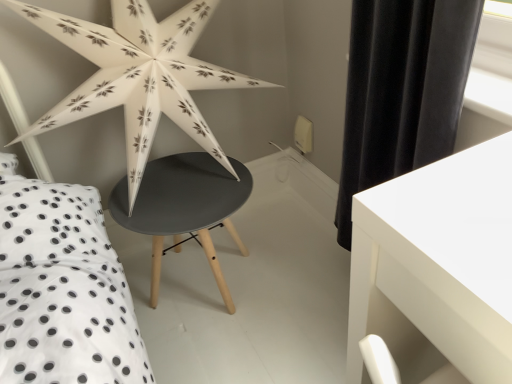
Question: Does white paper star at upper left have a lesser width compared to white glossy table at lower right, the second table positioned from the left?

Choices:
 (A) yes
 (B) no

Answer: (A)

Question: Is white glossy table at lower right, the 2th table positioned from the back, completely or partially inside white paper star at upper left?

Choices:
 (A) no
 (B) yes

Answer: (A)

Question: Is white paper star at upper left closer to the viewer compared to white glossy table at lower right, the second table positioned from the left?

Choices:
 (A) yes
 (B) no

Answer: (B)

Question: Is white paper star at upper left at the right side of white glossy table at lower right, the 1th table positioned from the right?

Choices:
 (A) yes
 (B) no

Answer: (B)

Question: Is white paper star at upper left further to camera compared to white glossy table at lower right, the 1th table positioned from the right?

Choices:
 (A) no
 (B) yes

Answer: (B)

Question: In terms of width, does matte black table at center, arranged as the second table when viewed from the right, look wider or thinner when compared to white glossy table at lower right, the second table positioned from the left?

Choices:
 (A) thin
 (B) wide

Answer: (A)

Question: From a real-world perspective, relative to white glossy table at lower right, the 1th table positioned from the right, is matte black table at center, the first table when ordered from left to right, vertically above or below?

Choices:
 (A) below
 (B) above

Answer: (A)

Question: Is matte black table at center, arranged as the second table when viewed from the right, taller or shorter than white glossy table at lower right, the second table positioned from the left?

Choices:
 (A) short
 (B) tall

Answer: (A)

Question: In the image, is matte black table at center, which is the first table from back to front, positioned in front of or behind white glossy table at lower right, the 1th table positioned from the right?

Choices:
 (A) behind
 (B) front

Answer: (A)

Question: In the image, is white glossy table at lower right, the first table in the front-to-back sequence, on the left side or the right side of matte black table at center, which is the first table from back to front?

Choices:
 (A) left
 (B) right

Answer: (B)

Question: Looking at their shapes, would you say white glossy table at lower right, the first table in the front-to-back sequence, is wider or thinner than matte black table at center, arranged as the second table when viewed from the right?

Choices:
 (A) wide
 (B) thin

Answer: (A)

Question: Does point (404, 337) appear closer or farther from the camera than point (123, 200)?

Choices:
 (A) closer
 (B) farther

Answer: (A)

Question: Is white glossy table at lower right, the second table positioned from the left, taller or shorter than matte black table at center, the first table when ordered from left to right?

Choices:
 (A) short
 (B) tall

Answer: (B)

Question: Is point coord(185,36) positioned closer to the camera than point coord(187,158)?

Choices:
 (A) farther
 (B) closer

Answer: (B)

Question: From the image's perspective, is white paper star at upper left positioned above or below matte black table at center, the first table when ordered from left to right?

Choices:
 (A) above
 (B) below

Answer: (A)